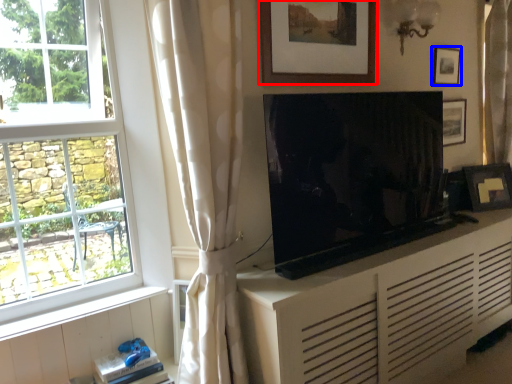
Question: Among these objects, which one is farthest to the camera, picture frame (highlighted by a red box) or picture frame (highlighted by a blue box)?

Choices:
 (A) picture frame
 (B) picture frame

Answer: (B)